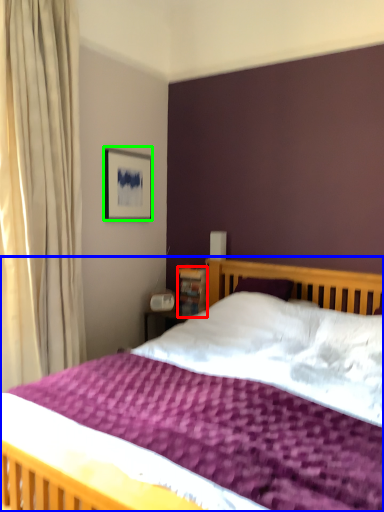
Question: Which is nearer to the bookshelf (highlighted by a red box)? bed (highlighted by a blue box) or picture frame (highlighted by a green box).

Choices:
 (A) bed
 (B) picture frame

Answer: (B)